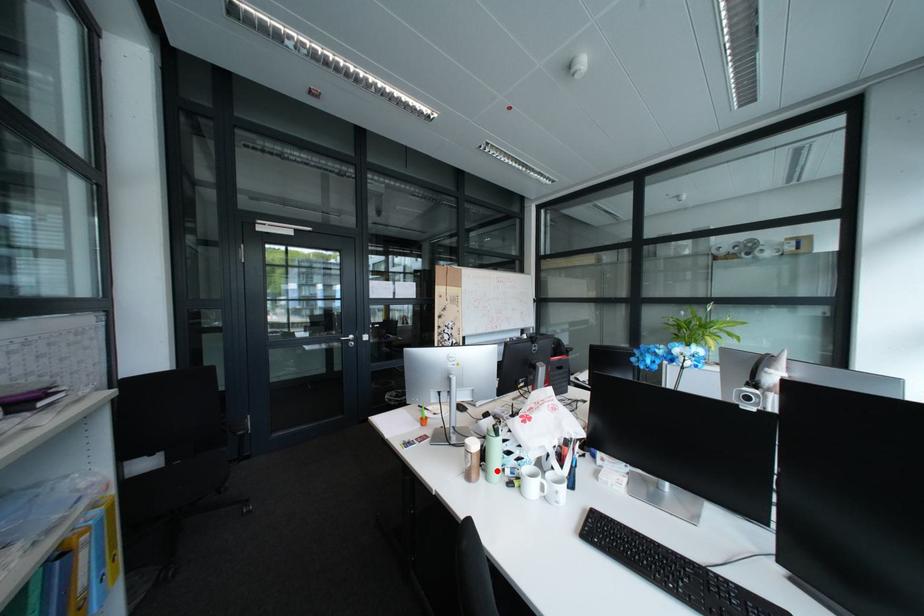
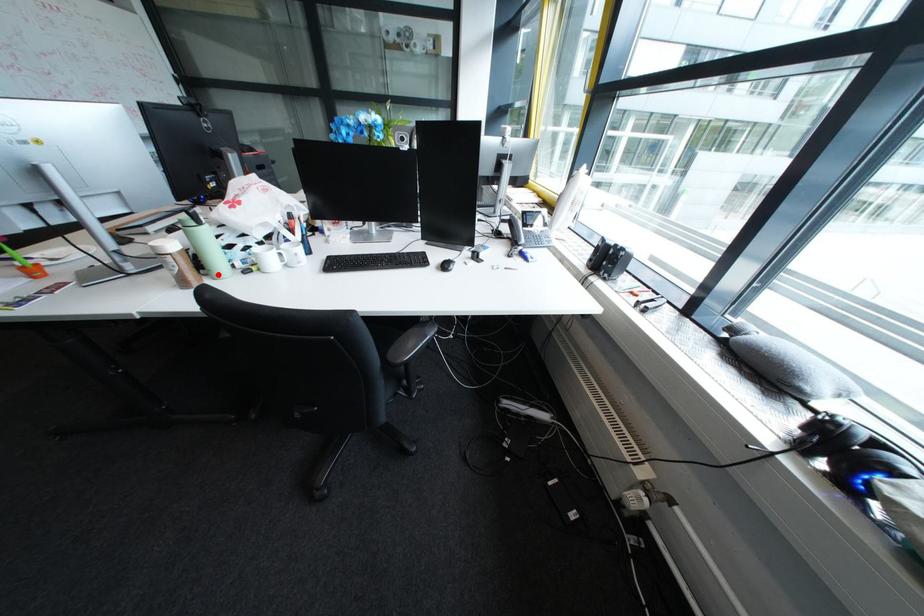
I am providing you with two images of the same scene from different viewpoints. A red point is marked on the first image and another point is marked on the second image. Does the point marked in image1 correspond to the same location as the one in image2?

Yes